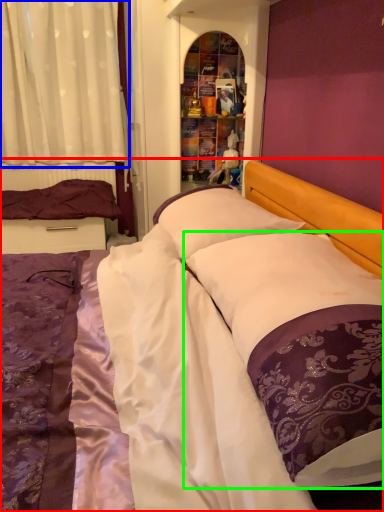
Question: Which is farther away from bed (highlighted by a red box)? curtain (highlighted by a blue box) or pillow (highlighted by a green box)?

Choices:
 (A) curtain
 (B) pillow

Answer: (A)